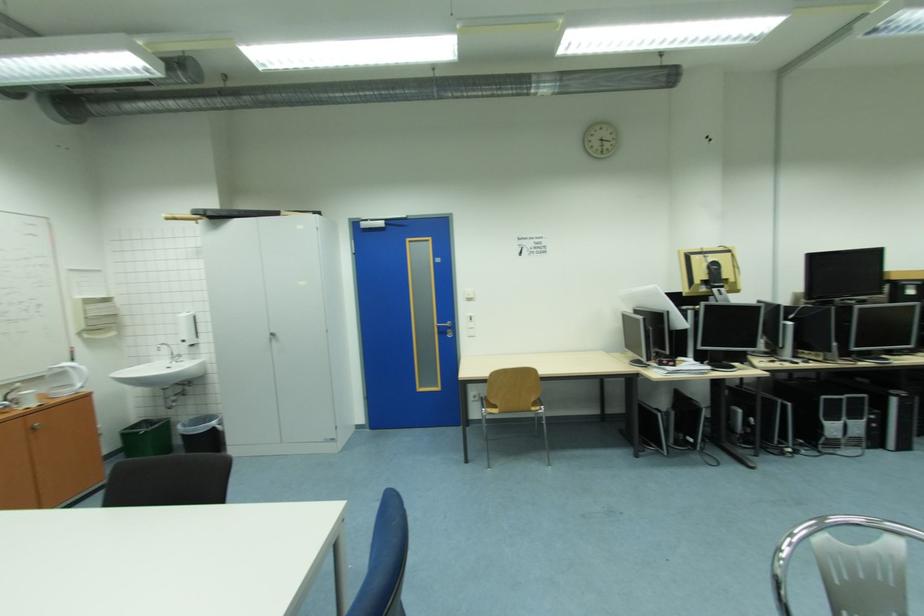
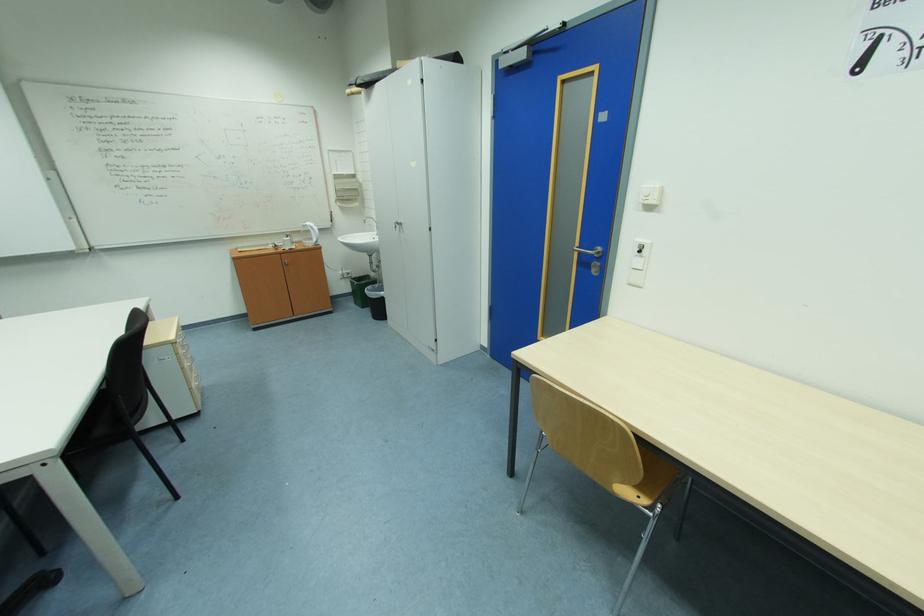
Where in the second image is the point corresponding to (x=67, y=369) from the first image?

(313, 225)